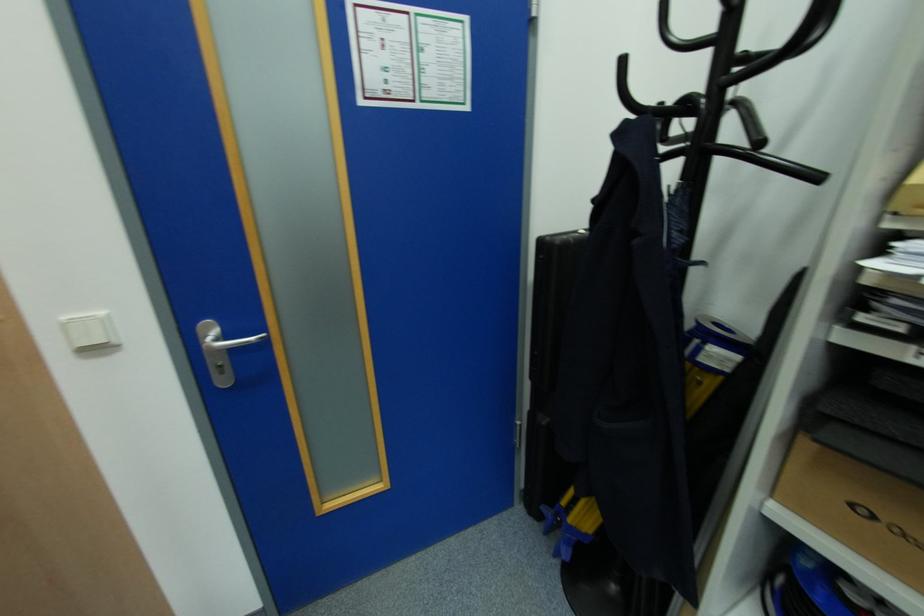
What do you see at coordinates (728, 87) in the screenshot?
I see `the black coat hook` at bounding box center [728, 87].